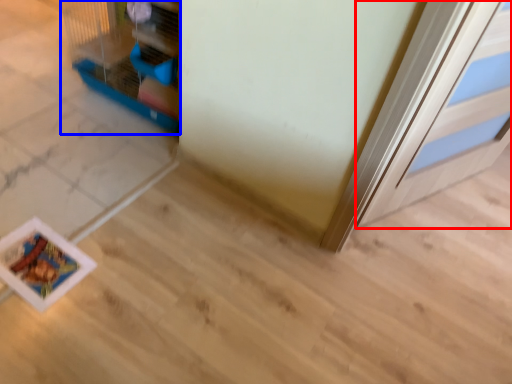
Question: Which point is closer to the camera, door (highlighted by a red box) or bird cage (highlighted by a blue box)?

Choices:
 (A) door
 (B) bird cage

Answer: (A)